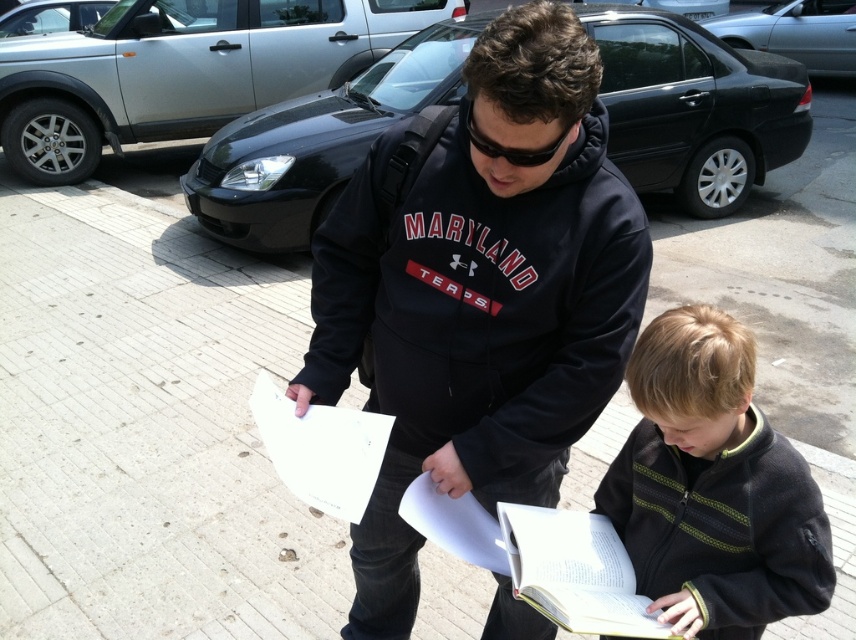
In the scene shown: Does dark gray fleece jacket at lower right appear over white paper book at lower right?

Yes.

Is point (791, 449) positioned after point (572, 520)?

No, it is not.

The image size is (856, 640). Identify the location of dark gray fleece jacket at lower right. (712, 486).

Does black fleece sweatshirt at center appear over white paper at center?

Actually, black fleece sweatshirt at center is below white paper at center.

Who is lower down, black fleece sweatshirt at center or white paper at center?

black fleece sweatshirt at center is lower down.

Is point (375, 570) closer to camera compared to point (336, 474)?

No, (375, 570) is behind (336, 474).

Identify the location of black fleece sweatshirt at center. (479, 292).

Is white paper book at lower right smaller than white paper at center?

No.

Can you confirm if white paper book at lower right is bigger than white paper at center?

Yes.

Find the location of a particular element. The image size is (856, 640). white paper book at lower right is located at coordinates (539, 557).

Identify the location of white paper book at lower right. (539, 557).